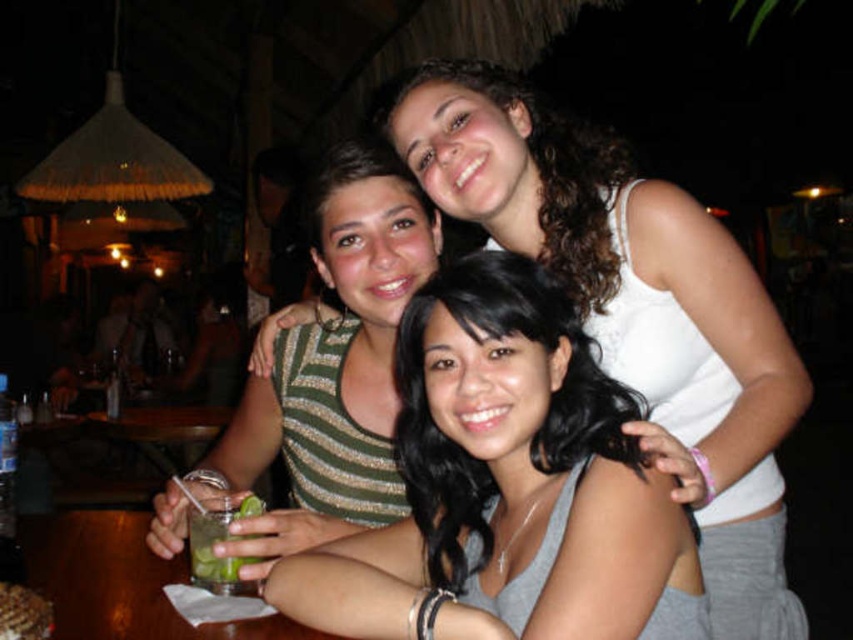
You are a photographer setting up a camera in the scene. You want to ensure both the gray matte tank top at center and the green striped shirt at center are clearly visible in the frame. Given their sizes, which one might require more space in the composition to avoid being cropped?

The gray matte tank top at center requires more space in the composition because its width is larger than the green striped shirt at center, so it needs to be positioned to avoid cropping.

You are a photographer taking a group photo of the scene. The green striped shirt at center and the green leafy drink at center are both in the frame. Which object is wider?

The green striped shirt at center is wider than the green leafy drink at center according to the description provided.

You are standing in the bar scene and want to move from point A to point B. The coordinates for point A are point (408, 595) and point B are point (219, 529). Which point is closer to you?

Point (408, 595) is closer to the viewer than point (219, 529).